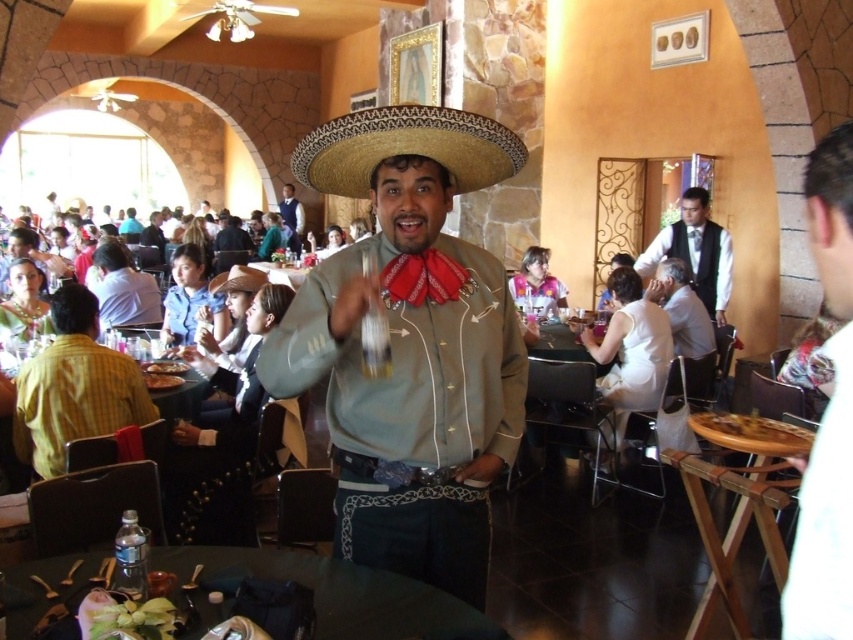
You are a server in the restaurant and need to place a 3.0 meter long tablecloth on the green fabric table at lower center. The brown felt cowboy hat at center is currently on the table. Can you remove the hat first before placing the tablecloth?

The green fabric table at lower center and brown felt cowboy hat at center are 2.80 meters apart, so the hat is not on the table. You can place the tablecloth without removing the hat.

You are a guest at this event and want to place your drink on the green fabric table at lower center. However, you notice the brown felt cowboy hat at center is in the way. Based on their positions, can you easily move the hat to access the table?

The green fabric table at lower center is to the right of the brown felt cowboy hat at center, so you can easily move the hat to the left to access the table.

You are a guest at this event and want to place your drink on a surface that is higher than the brown felt cowboy hat at center. Is the golden brown bread at table right a suitable surface for this?

The golden brown bread at table right is below the brown felt cowboy hat at center, so it is lower. Therefore, it is not a suitable surface for placing your drink if you require a higher surface than the brown felt cowboy hat at center.